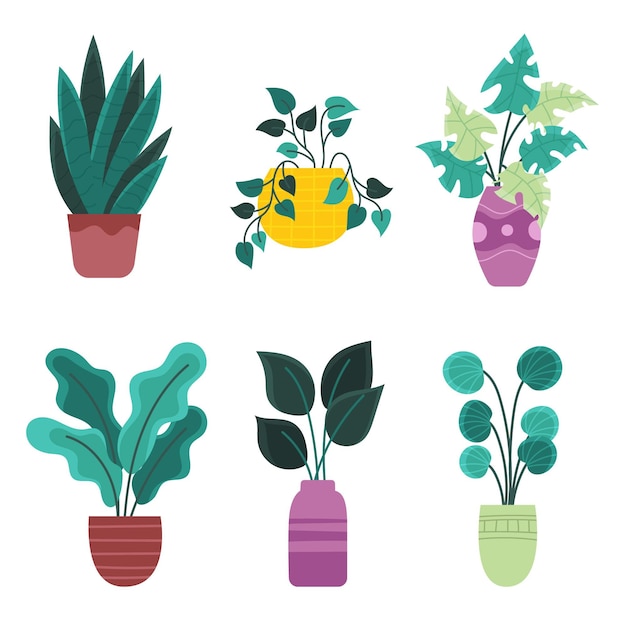
You are a GUI agent. You are given a task and a screenshot of the screen. Output one action in this format:
    pyautogui.click(x=<x>, y=<y>)
    Task: Click on the circle design on vase
    Image resolution: width=626 pixels, height=626 pixels.
    Given the screenshot: What is the action you would take?
    pyautogui.click(x=478, y=233), pyautogui.click(x=508, y=230), pyautogui.click(x=538, y=231)